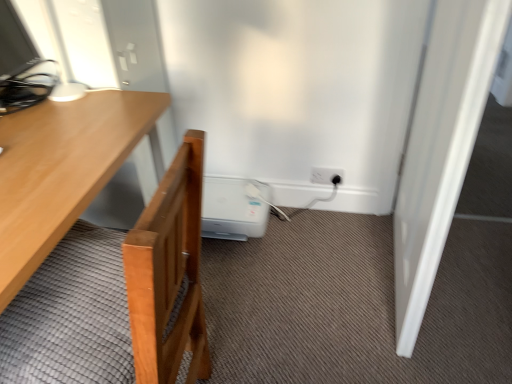
Question: Would you say white plastic electric outlet at lower right is to the left or to the right of wooden desk at left in the picture?

Choices:
 (A) left
 (B) right

Answer: (B)

Question: Is white plastic electric outlet at lower right spatially inside wooden desk at left, or outside of it?

Choices:
 (A) outside
 (B) inside

Answer: (A)

Question: Estimate the real-world distances between objects in this image. Which object is closer to the white smooth door at right?

Choices:
 (A) white plastic electric outlet at lower right
 (B) white plastic water heater at lower center
 (C) wooden desk at left

Answer: (A)

Question: Which object is positioned closest to the white plastic water heater at lower center?

Choices:
 (A) white smooth door at right
 (B) white plastic electric outlet at lower right
 (C) wooden desk at left

Answer: (B)